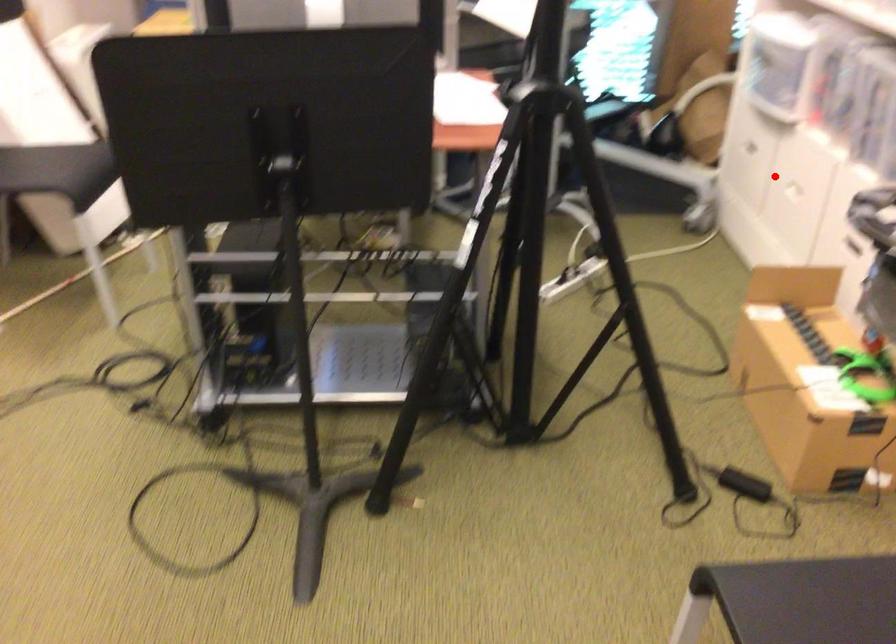
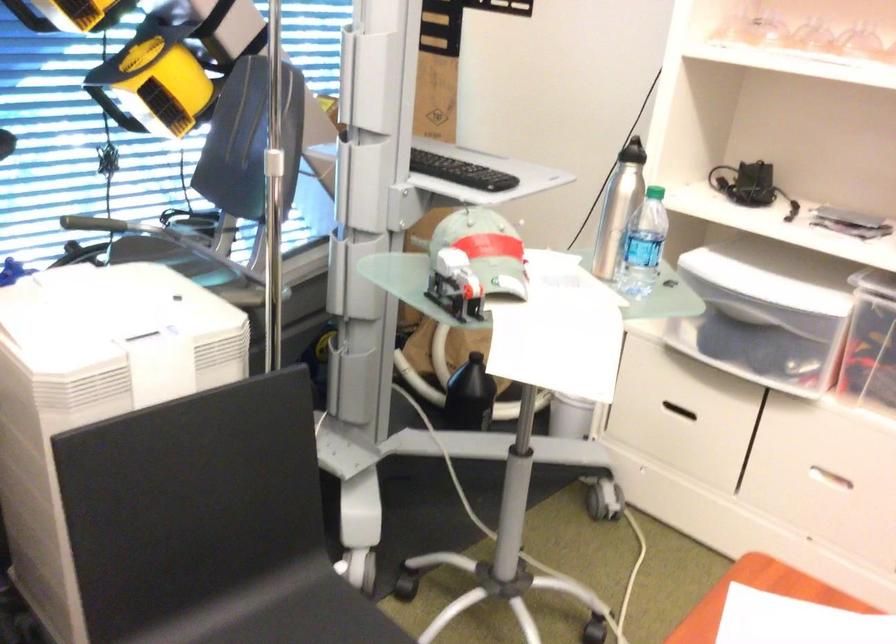
Question: I am providing you with two images of the same scene from different viewpoints. In image1, a red point is highlighted. Considering the same 3D point in image2, which of the following is correct?

Choices:
 (A) It is closer
 (B) It is farther

Answer: (A)